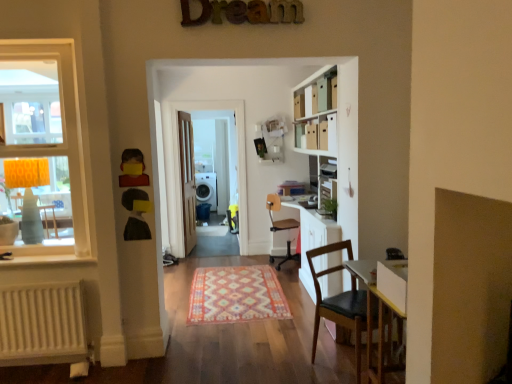
Question: Is brown leather chair at lower right, the first chair positioned from the front, positioned behind light brown wooden door at center?

Choices:
 (A) no
 (B) yes

Answer: (A)

Question: Is brown leather chair at lower right, arranged as the 2th chair when viewed from the back, shorter than light brown wooden door at center?

Choices:
 (A) no
 (B) yes

Answer: (B)

Question: From the image's perspective, is brown leather chair at lower right, the first chair positioned from the front, located beneath light brown wooden door at center?

Choices:
 (A) no
 (B) yes

Answer: (B)

Question: From the image's perspective, would you say brown leather chair at lower right, arranged as the 2th chair when viewed from the back, is positioned over light brown wooden door at center?

Choices:
 (A) no
 (B) yes

Answer: (A)

Question: Would you consider brown leather chair at lower right, arranged as the 2th chair when viewed from the back, to be distant from light brown wooden door at center?

Choices:
 (A) yes
 (B) no

Answer: (A)

Question: Can we say brown leather chair at lower right, arranged as the 2th chair when viewed from the back, lies outside light brown wooden door at center?

Choices:
 (A) no
 (B) yes

Answer: (B)

Question: From the image's perspective, is brown leather chair at lower right, arranged as the 2th chair when viewed from the back, beneath matte yellow lampshade at left?

Choices:
 (A) yes
 (B) no

Answer: (A)

Question: Is brown leather chair at lower right, arranged as the 2th chair when viewed from the back, in contact with matte yellow lampshade at left?

Choices:
 (A) yes
 (B) no

Answer: (B)

Question: Could you tell me if brown leather chair at lower right, arranged as the 2th chair when viewed from the back, is turned towards matte yellow lampshade at left?

Choices:
 (A) yes
 (B) no

Answer: (B)

Question: Can you confirm if brown leather chair at lower right, the first chair positioned from the front, is thinner than matte yellow lampshade at left?

Choices:
 (A) yes
 (B) no

Answer: (A)

Question: Is the position of brown leather chair at lower right, the first chair positioned from the front, more distant than that of matte yellow lampshade at left?

Choices:
 (A) yes
 (B) no

Answer: (B)

Question: From a real-world perspective, is brown leather chair at lower right, arranged as the 2th chair when viewed from the back, beneath matte yellow lampshade at left?

Choices:
 (A) no
 (B) yes

Answer: (B)

Question: From a real-world perspective, is white glossy door at center positioned under white plastic speaker at center based on gravity?

Choices:
 (A) yes
 (B) no

Answer: (B)